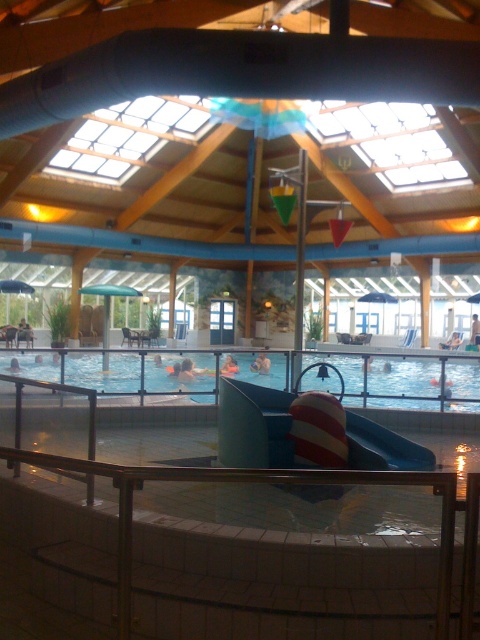
Is point (111, 362) positioned behind point (262, 365)?

That is False.

Which is above, clear plastic pool at center or light blue fabric swimmer at center?

light blue fabric swimmer at center

The width and height of the screenshot is (480, 640). Identify the location of clear plastic pool at center. (404, 381).

In the scene shown: Is light blue fabric swimmer at center wider than smooth skin person at lower left?

No.

Measure the distance between light blue fabric swimmer at center and smooth skin person at lower left.

light blue fabric swimmer at center is 32.03 feet from smooth skin person at lower left.

Who is more distant from viewer, [254,362] or [27,323]?

The point [27,323] is more distant.

Locate an element on the screen. This screenshot has height=640, width=480. light blue fabric swimmer at center is located at coordinates (261, 364).

Can you confirm if light blue fabric swimmer at center is positioned above skinny white person at center?

Incorrect, light blue fabric swimmer at center is not positioned above skinny white person at center.

Does point (259, 358) come closer to viewer compared to point (475, 317)?

Yes, it is.

Which is in front, point (268, 364) or point (472, 337)?

Point (268, 364) is more forward.

You are a GUI agent. You are given a task and a screenshot of the screen. Output one action in this format:
    pyautogui.click(x=<x>, y=<y>)
    Task: Click on the light blue fabric swimmer at center
    
    Given the screenshot: What is the action you would take?
    pyautogui.click(x=261, y=364)